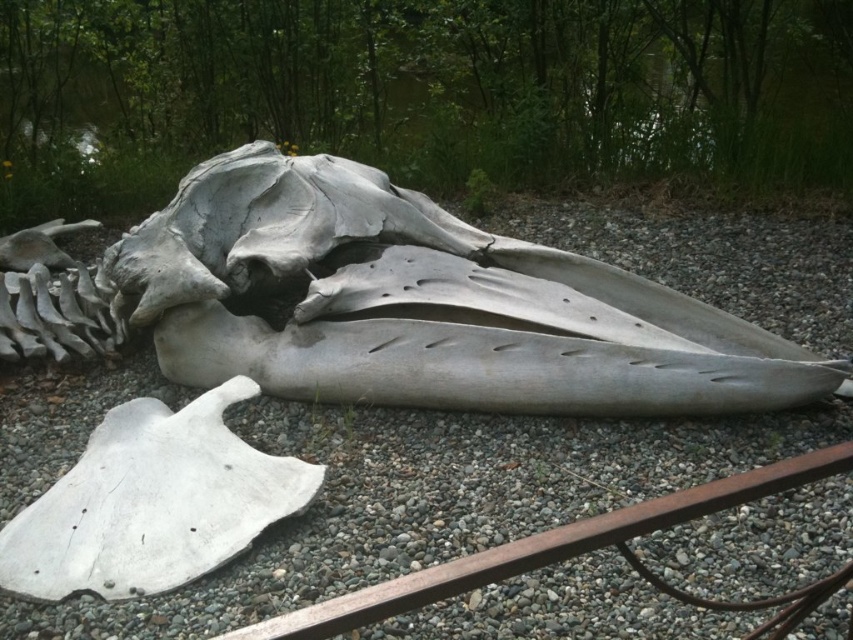
Question: Observing the image, what is the correct spatial positioning of gray gravel at center in reference to gray matte skull at center?

Choices:
 (A) left
 (B) right

Answer: (B)

Question: Is gray gravel at center below gray matte skull at center?

Choices:
 (A) yes
 (B) no

Answer: (A)

Question: Can you confirm if gray gravel at center is wider than gray matte skull at center?

Choices:
 (A) no
 (B) yes

Answer: (A)